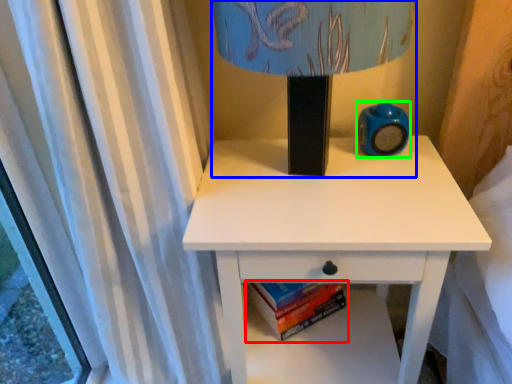
Question: Based on their relative distances, which object is nearer to paperback book (highlighted by a red box)? Choose from table lamp (highlighted by a blue box) and teal (highlighted by a green box).

Choices:
 (A) table lamp
 (B) teal

Answer: (B)